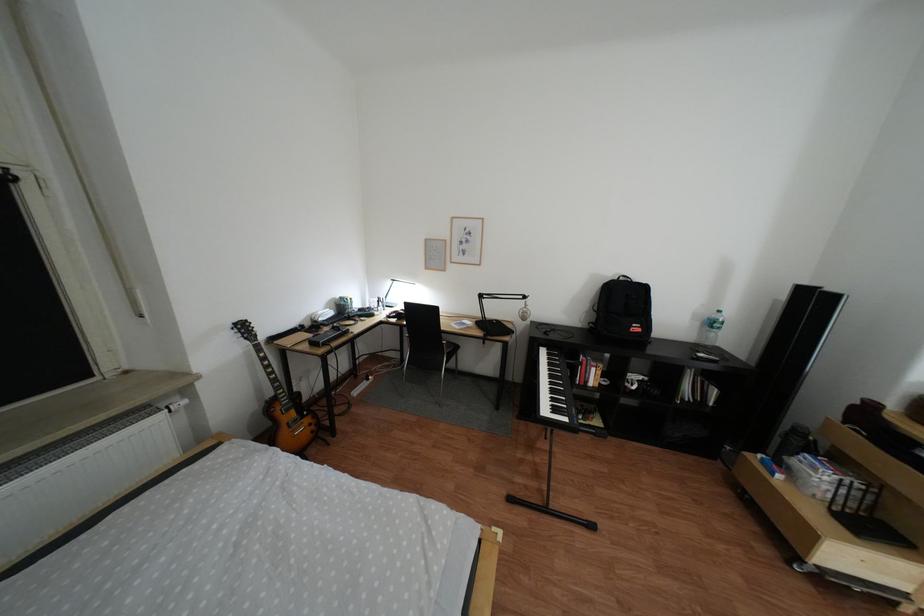
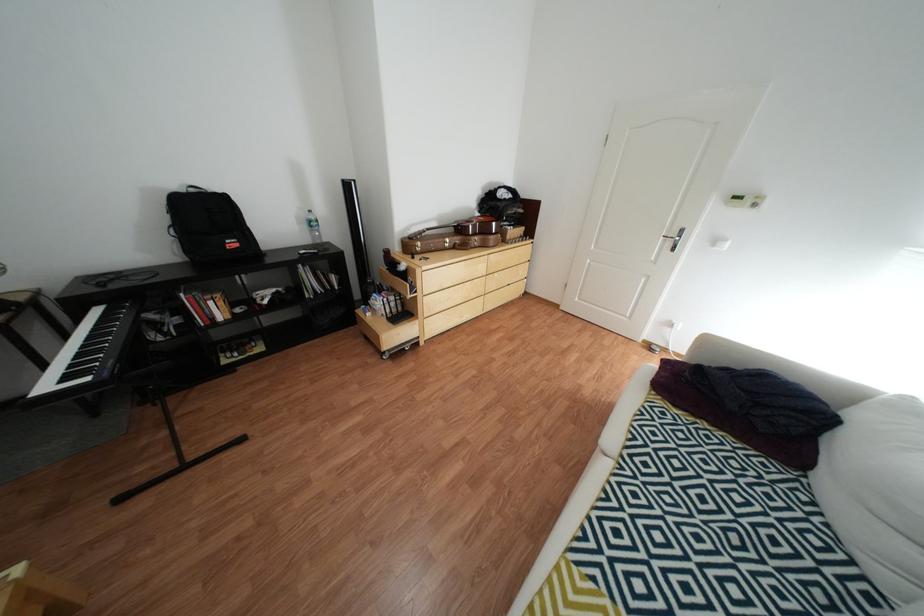
The images are taken continuously from a first-person perspective. In which direction is your viewpoint rotating?

The camera rotated toward right-down.